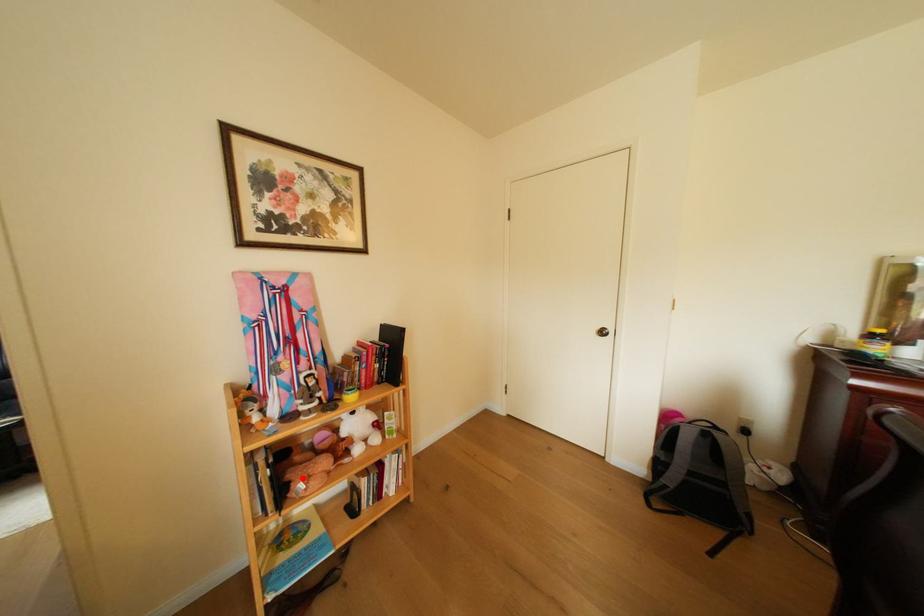
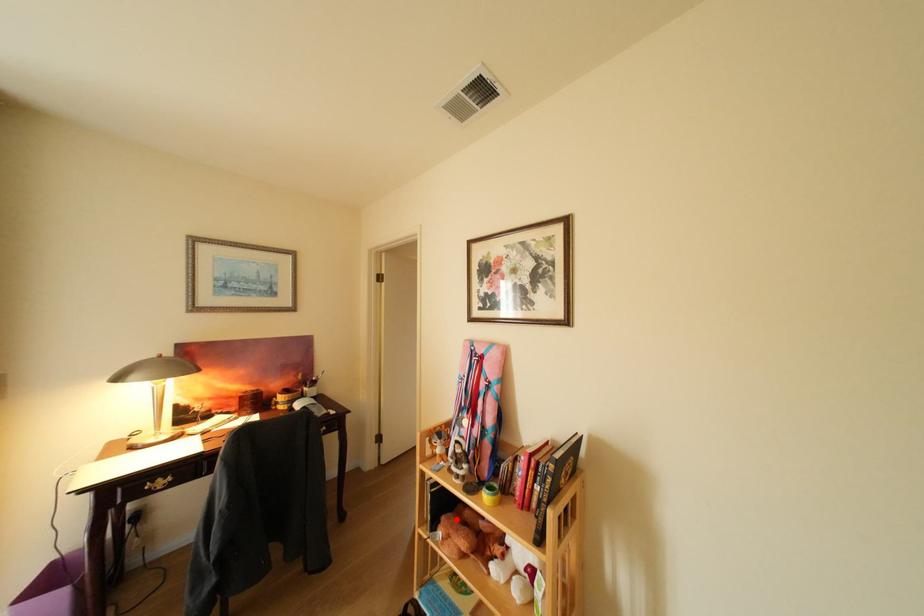
I am providing you with two images of the same scene from different viewpoints. A red point is marked on the first image and another point is marked on the second image. Is the marked point in image1 the same physical position as the marked point in image2?

Yes